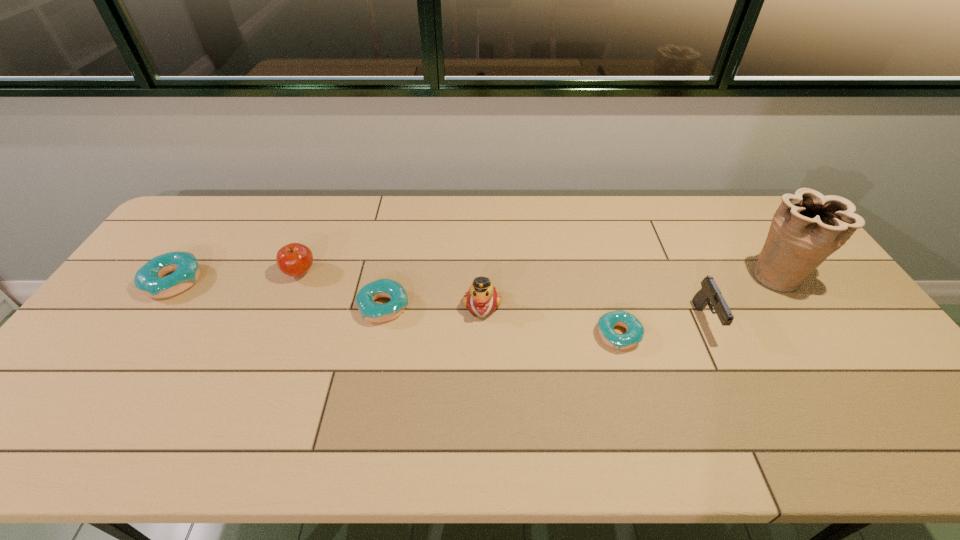
I want to click on free space located 0.100m on the right of the leftmost object, so click(x=236, y=281).

Identify the location of vacant space located on the front of the second doughnut from left to right. (365, 403).

The image size is (960, 540). Find the location of `vacant space located on the right of the shortest doughnut`. vacant space located on the right of the shortest doughnut is located at coordinates (683, 335).

Where is `free space located on the left of the rightmost object`? The height and width of the screenshot is (540, 960). free space located on the left of the rightmost object is located at coordinates (695, 277).

Identify the location of free space located on the front of the second object from left to right. (254, 384).

Where is `vacant region located aim along the barrel of the pistol`? Image resolution: width=960 pixels, height=540 pixels. vacant region located aim along the barrel of the pistol is located at coordinates (743, 402).

The width and height of the screenshot is (960, 540). I want to click on vacant space located on the face of the fourth object from right to left, so pyautogui.click(x=483, y=386).

Find the location of a particular element. The height and width of the screenshot is (540, 960). object located at the left edge is located at coordinates (149, 278).

Find the location of a particular element. object that is positioned at the right edge is located at coordinates (807, 227).

At what (x,y) coordinates should I click in order to perform the action: click on vacant space at the far edge. Please return your answer as a coordinate pair (x, y). The image size is (960, 540). Looking at the image, I should click on 411,238.